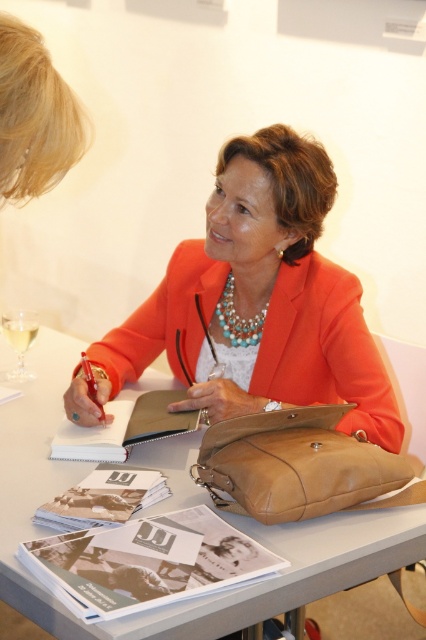
Question: Considering the real-world distances, which object is farthest from the leather bag at center?

Choices:
 (A) orange leather jacket at center
 (B) turquoise pearl necklace at center

Answer: (B)

Question: Observing the image, what is the correct spatial positioning of orange leather jacket at center in reference to turquoise pearl necklace at center?

Choices:
 (A) below
 (B) above

Answer: (A)

Question: Can you confirm if smooth gray table at center is wider than turquoise pearl necklace at center?

Choices:
 (A) no
 (B) yes

Answer: (B)

Question: Does smooth gray table at center have a greater width compared to clear glass wine glass at left?

Choices:
 (A) no
 (B) yes

Answer: (B)

Question: Which object appears closest to the camera in this image?

Choices:
 (A) clear glass wine glass at left
 (B) smooth gray table at center

Answer: (B)

Question: Which object appears farthest from the camera in this image?

Choices:
 (A) orange leather jacket at center
 (B) turquoise pearl necklace at center

Answer: (B)